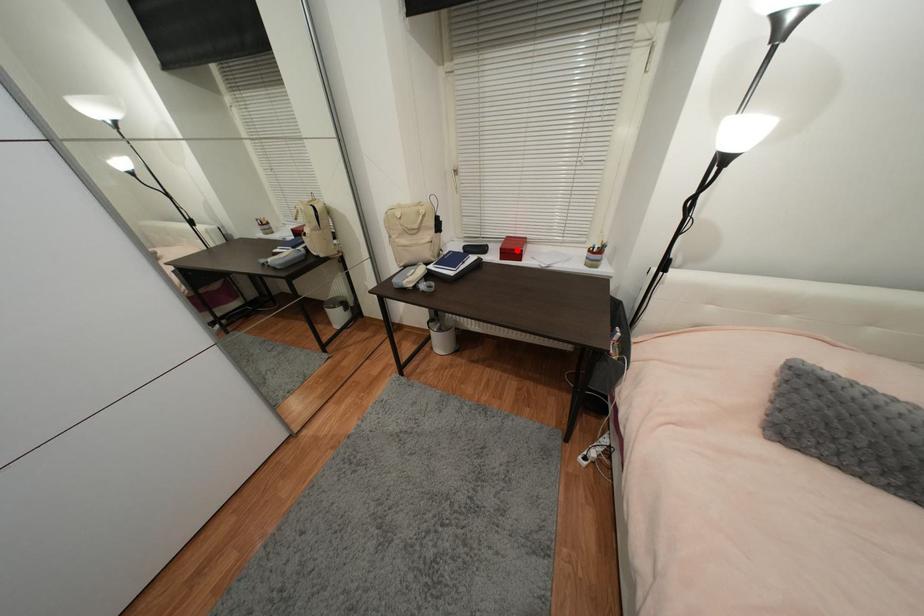
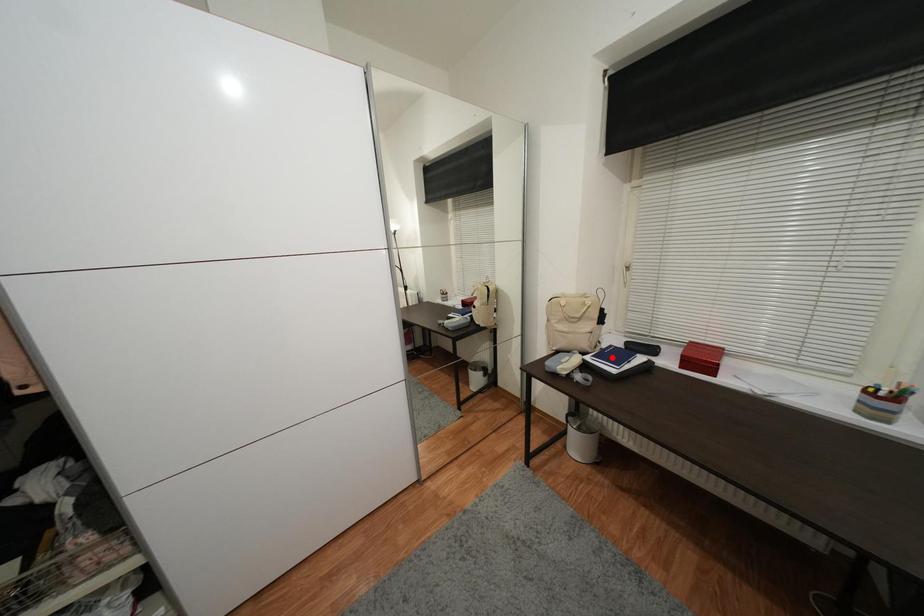
I am providing you with two images of the same scene from different viewpoints. A red point is marked on the first image and another point is marked on the second image. Is the red point in image1 aligned with the point shown in image2?

No